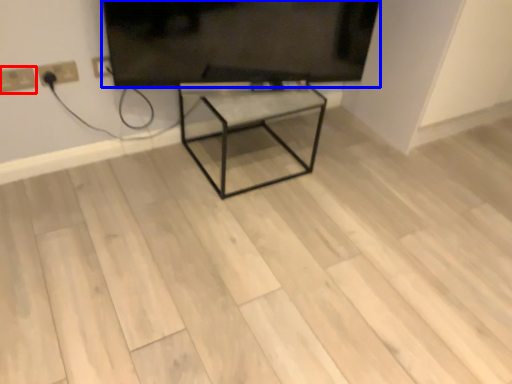
Question: Among these objects, which one is farthest to the camera, electric outlet (highlighted by a red box) or television (highlighted by a blue box)?

Choices:
 (A) electric outlet
 (B) television

Answer: (A)